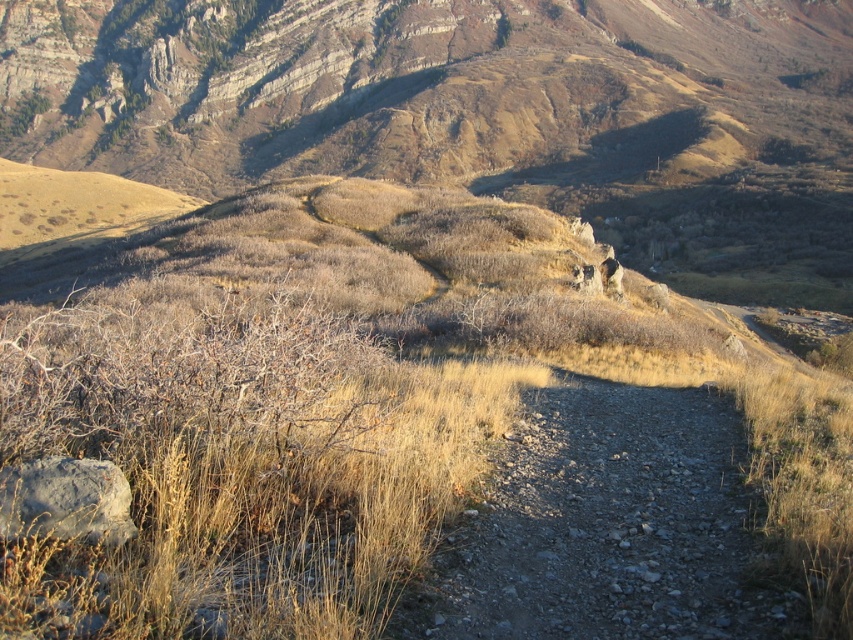
You are a hiker who wants to cross from the dry grass at center to the dusty gravel path at center. Based on the distance provided, can you safely make this crossing without needing to detour around the area?

The distance between dry grass at center and dusty gravel path at center is 93.23 feet. Since this is a considerable distance, you would need to detour around the area to reach the path safely.

You are standing at the starting point of the dirt path and want to place a small marker exactly at the dry grass at center. According to the coordinates provided, what are the exact coordinates where you should place the marker?

The exact coordinates for the dry grass at center are at point (368, 413).

You are standing at the start of the path and want to step onto the dusty gravel path at center. Which direction should you move to reach it from the dry grass at center?

Since the dry grass at center is closer to the viewer than the dusty gravel path at center, you should move backward to reach the dusty gravel path at center from the dry grass at center.